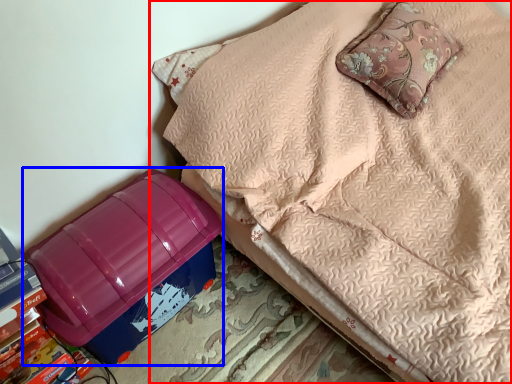
Question: Which object appears closest to the camera in this image, furniture (highlighted by a red box) or storage box (highlighted by a blue box)?

Choices:
 (A) furniture
 (B) storage box

Answer: (A)